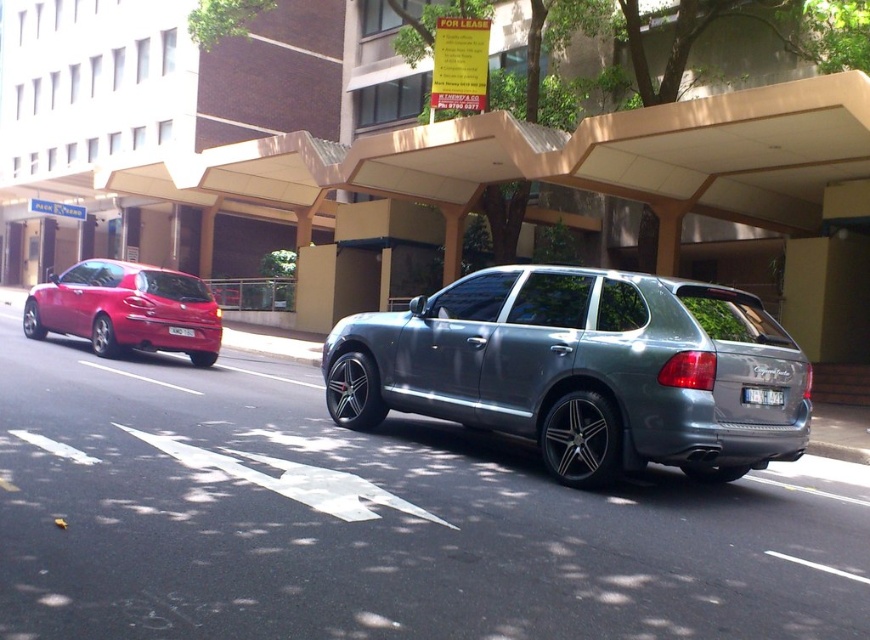
Does matte red hatchback at left appear on the left side of white plastic license plate at center?

Indeed, matte red hatchback at left is positioned on the left side of white plastic license plate at center.

Can you confirm if matte red hatchback at left is positioned to the right of white plastic license plate at center?

In fact, matte red hatchback at left is to the left of white plastic license plate at center.

Locate an element on the screen. matte red hatchback at left is located at coordinates (126, 308).

Can you confirm if metallic gray suv at center is positioned above white plastic license plate at center?

No.

Where is `metallic gray suv at center`? metallic gray suv at center is located at coordinates (581, 369).

I want to click on metallic gray suv at center, so [581, 369].

Describe the element at coordinates (126, 308) in the screenshot. The width and height of the screenshot is (870, 640). I see `matte red hatchback at left` at that location.

Is matte red hatchback at left wider than white plastic license plate at rear?

Yes.

Is point (202, 296) behind point (753, 403)?

Yes, it is.

Where is `matte red hatchback at left`? This screenshot has width=870, height=640. matte red hatchback at left is located at coordinates (126, 308).